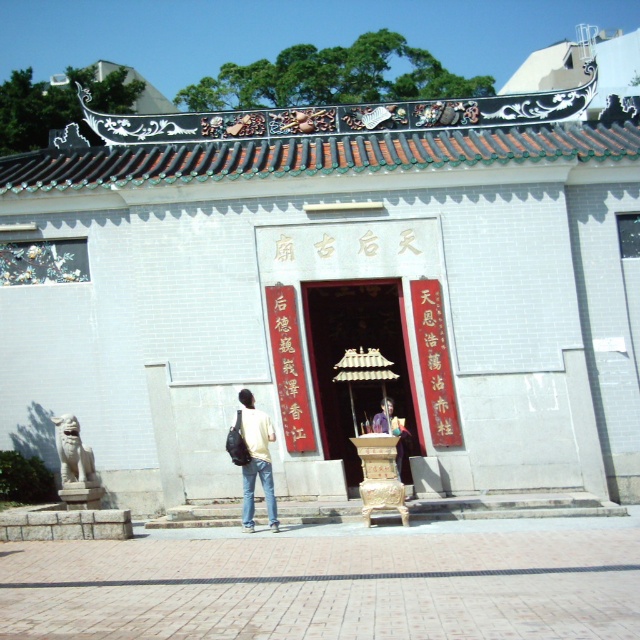
Consider the image. You are standing in front of the Tin Hau Temple entrance and notice two points marked on the temple structure. The first point is at coordinates point [234,452] and the second is at point [381,410]. Which point is positioned closer to your current viewpoint?

Point [234,452] is closer to the viewer than point [381,410].